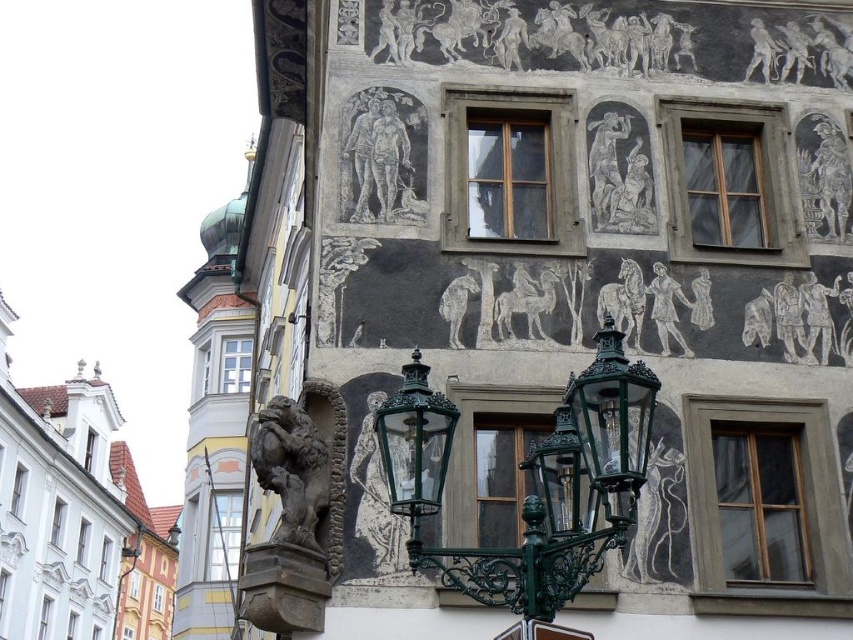
You are an architect examining the historic building. You notice the gray stone relief at upper right and the gray stone statue at upper right. Which of these two objects is taller?

The gray stone relief at upper right is taller than the gray stone statue at upper right according to the description.

You are an architect examining the historic building. You notice the gray stone relief at upper right and the white marble horse at upper center. Which of these two objects is bigger?

The gray stone relief at upper right is larger in size than the white marble horse at upper center.

You are an architect analyzing the facade of this historic building. You need to determine the relative sizes of the gray stone relief at upper right and the white marble horse at upper center. Which one is taller?

The gray stone relief at upper right is taller than the white marble horse at upper center according to the description provided.